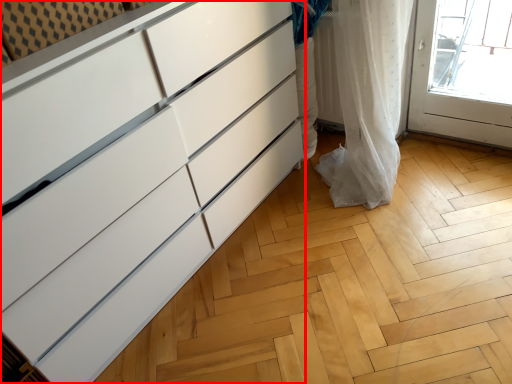
Question: From the image's perspective, what is the correct spatial relationship of chest of drawers (annotated by the red box) in relation to curtain?

Choices:
 (A) below
 (B) above

Answer: (A)